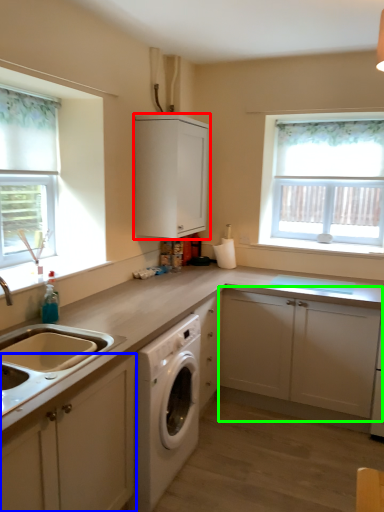
Question: Which is nearer to the cabinetry (highlighted by a red box)? cabinetry (highlighted by a blue box) or cabinetry (highlighted by a green box).

Choices:
 (A) cabinetry
 (B) cabinetry

Answer: (B)